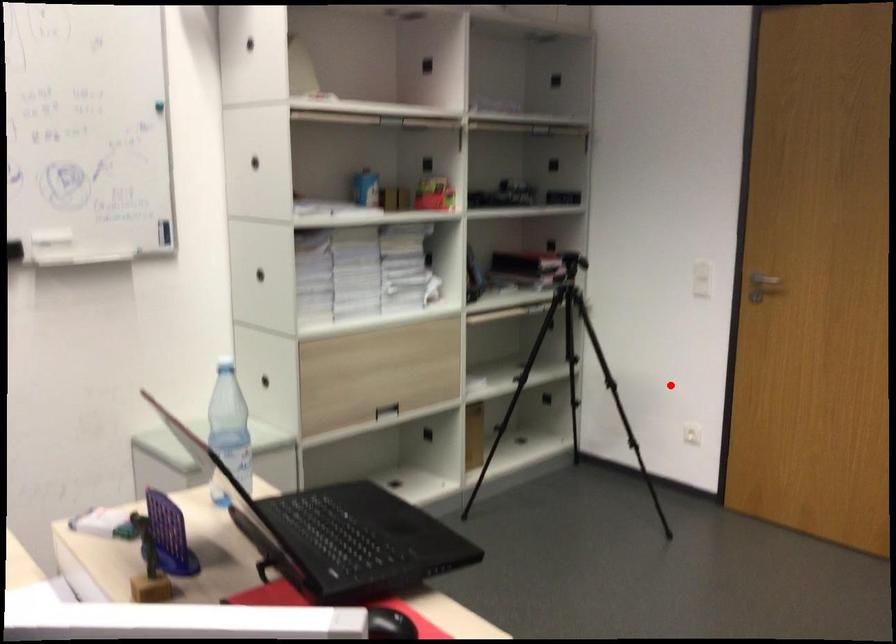
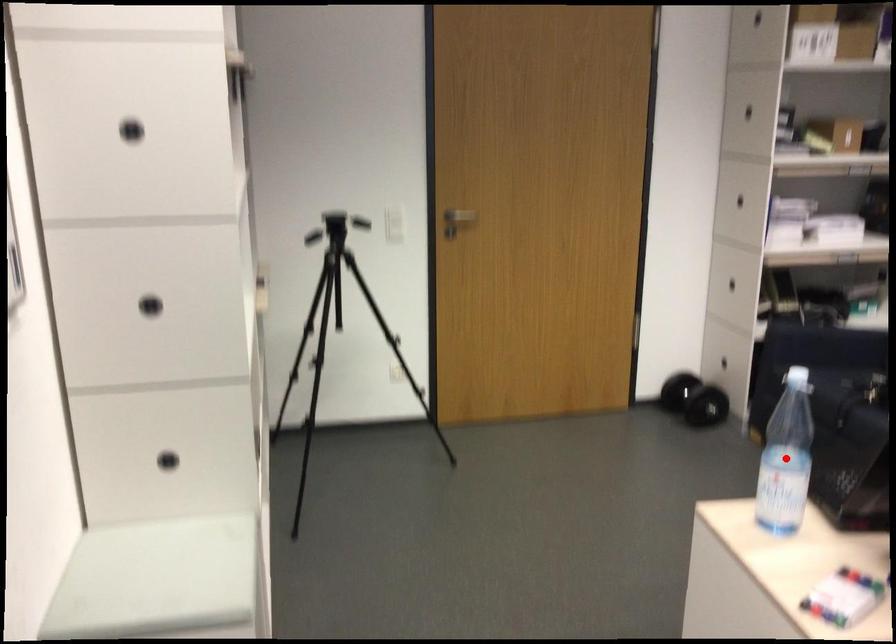
I am providing you with two images of the same scene from different viewpoints. A red point is marked on the first image and another point is marked on the second image. Are the points marked in image1 and image2 representing the same 3D position?

No